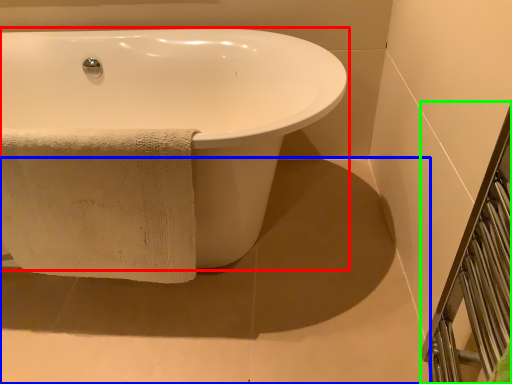
Question: Which is nearer to the bathtub (highlighted by a red box)? concrete (highlighted by a blue box) or balustrade (highlighted by a green box).

Choices:
 (A) concrete
 (B) balustrade

Answer: (A)